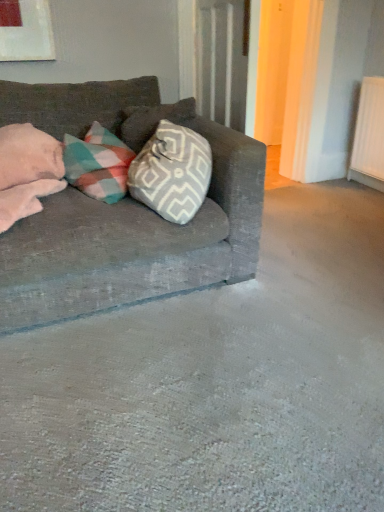
Identify the location of textured gray couch at left. (124, 212).

What do you see at coordinates (124, 212) in the screenshot? This screenshot has width=384, height=512. I see `textured gray couch at left` at bounding box center [124, 212].

What is the approximate height of textured gray couch at left?

The height of textured gray couch at left is 33.46 inches.

What is the approximate height of pink soft pillow at left?

The height of pink soft pillow at left is 21.24 centimeters.

The image size is (384, 512). Describe the element at coordinates (28, 156) in the screenshot. I see `pink soft pillow at left` at that location.

Find the location of a particular element. This screenshot has width=384, height=512. pink soft pillow at left is located at coordinates (28, 156).

You are a GUI agent. You are given a task and a screenshot of the screen. Output one action in this format:
    pyautogui.click(x=<x>, y=<y>)
    Task: Click on the textured gray couch at left
    
    Given the screenshot: What is the action you would take?
    pyautogui.click(x=124, y=212)

In the image, is textured gray couch at left on the left side or the right side of pink soft pillow at left?

From the image, it's evident that textured gray couch at left is to the right of pink soft pillow at left.

In the image, is textured gray couch at left positioned in front of or behind pink soft pillow at left?

textured gray couch at left is in front of pink soft pillow at left.

Which point is more distant from viewer, [122,125] or [57,150]?

The point [122,125] is behind.

From the image's perspective, is textured gray couch at left beneath pink soft pillow at left?

Yes, from the image's perspective, textured gray couch at left is beneath pink soft pillow at left.

From a real-world perspective, is textured gray couch at left below pink soft pillow at left?

Yes, from a real-world perspective, textured gray couch at left is below pink soft pillow at left.

Between textured gray couch at left and pink soft pillow at left, which one has larger width?

textured gray couch at left is wider.

Considering the relative sizes of textured gray couch at left and pink soft pillow at left in the image provided, is textured gray couch at left taller than pink soft pillow at left?

Yes.

Between textured gray couch at left and pink soft pillow at left, which one has larger size?

Bigger between the two is textured gray couch at left.

Is textured gray couch at left completely or partially outside of pink soft pillow at left?

Yes, textured gray couch at left is not within pink soft pillow at left.

Would you consider textured gray couch at left to be distant from pink soft pillow at left?

That's not correct — textured gray couch at left is a little close to pink soft pillow at left.

Is textured gray couch at left positioned with its back to pink soft pillow at left?

No, textured gray couch at left is not facing away from pink soft pillow at left.

There is a textured gray couch at left. Identify the location of pillow above it (from a real-world perspective). Image resolution: width=384 pixels, height=512 pixels. (28, 156).

Considering the positions of objects pink soft pillow at left and textured gray couch at left in the image provided, who is more to the left, pink soft pillow at left or textured gray couch at left?

pink soft pillow at left.

Is pink soft pillow at left behind textured gray couch at left?

Yes, pink soft pillow at left is further from the camera.

Is point (58, 155) positioned before point (174, 279)?

No, it is not.

From the image's perspective, which is above, pink soft pillow at left or textured gray couch at left?

From the image's view, pink soft pillow at left is above.

From a real-world perspective, which is physically below, pink soft pillow at left or textured gray couch at left?

textured gray couch at left.

Can you confirm if pink soft pillow at left is wider than textured gray couch at left?

In fact, pink soft pillow at left might be narrower than textured gray couch at left.

Is pink soft pillow at left taller than textured gray couch at left?

Incorrect, the height of pink soft pillow at left is not larger of that of textured gray couch at left.

Is pink soft pillow at left bigger or smaller than textured gray couch at left?

In the image, pink soft pillow at left appears to be smaller than textured gray couch at left.

Which is correct: pink soft pillow at left is inside textured gray couch at left, or outside of it?

pink soft pillow at left is enclosed within textured gray couch at left.

Is pink soft pillow at left beside textured gray couch at left?

No, pink soft pillow at left is not with textured gray couch at left.

Is pink soft pillow at left oriented away from textured gray couch at left?

That's right, pink soft pillow at left is facing away from textured gray couch at left.

How different are the orientations of pink soft pillow at left and textured gray couch at left in degrees?

The angle between the facing direction of pink soft pillow at left and the facing direction of textured gray couch at left is 23.4 degrees.

You are a GUI agent. You are given a task and a screenshot of the screen. Output one action in this format:
    pyautogui.click(x=<x>, y=<y>)
    Task: Click on the studio couch located underneath the pink soft pillow at left (from a real-world perspective)
    
    Given the screenshot: What is the action you would take?
    (124, 212)

You are a GUI agent. You are given a task and a screenshot of the screen. Output one action in this format:
    pyautogui.click(x=<x>, y=<y>)
    Task: Click on the pillow above the textured gray couch at left (from the image's perspective)
    The image size is (384, 512).
    Given the screenshot: What is the action you would take?
    tap(28, 156)

At what (x,y) coordinates should I click in order to perform the action: click on studio couch in front of the pink soft pillow at left. Please return your answer as a coordinate pair (x, y). Looking at the image, I should click on (124, 212).